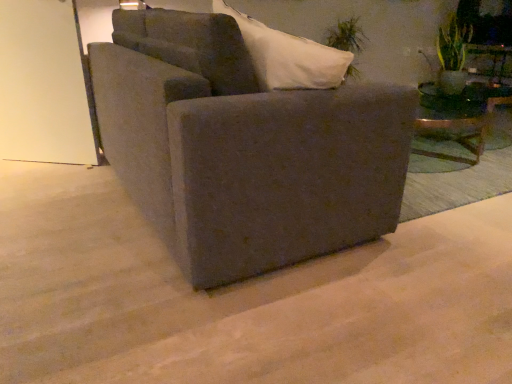
Question: In terms of width, does matte gray couch at center look wider or thinner when compared to transparent glass door at upper left?

Choices:
 (A) wide
 (B) thin

Answer: (A)

Question: From their relative heights in the image, would you say matte gray couch at center is taller or shorter than transparent glass door at upper left?

Choices:
 (A) tall
 (B) short

Answer: (B)

Question: Which is nearer to the transparent glass door at upper left?

Choices:
 (A) matte gray couch at center
 (B) green leafy plant at upper right, which is counted as the second plant, starting from the left
 (C) green leafy plant at upper right, the 1th plant when ordered from left to right

Answer: (A)

Question: Considering the real-world distances, which object is closest to the transparent glass door at upper left?

Choices:
 (A) green leafy plant at upper right, the 1th plant when ordered from left to right
 (B) matte gray couch at center
 (C) green leafy plant at upper right, the 1th plant viewed from the front

Answer: (B)